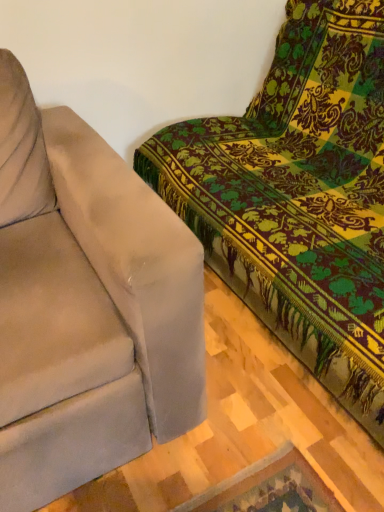
Question: From a real-world perspective, does velvet beige couch at upper right, which is counted as the second studio couch, starting from the left, sit lower than suede-like beige couch at left, which is the first studio couch from left to right?

Choices:
 (A) no
 (B) yes

Answer: (A)

Question: Is velvet beige couch at upper right, which is counted as the second studio couch, starting from the left, located outside suede-like beige couch at left, which is the first studio couch from left to right?

Choices:
 (A) yes
 (B) no

Answer: (A)

Question: Does velvet beige couch at upper right, the first studio couch when ordered from right to left, have a larger size compared to suede-like beige couch at left, marked as the second studio couch in a right-to-left arrangement?

Choices:
 (A) no
 (B) yes

Answer: (B)

Question: Does velvet beige couch at upper right, which is counted as the second studio couch, starting from the left, have a lesser height compared to suede-like beige couch at left, marked as the second studio couch in a right-to-left arrangement?

Choices:
 (A) no
 (B) yes

Answer: (A)

Question: Is velvet beige couch at upper right, which is counted as the second studio couch, starting from the left, positioned behind suede-like beige couch at left, which is the first studio couch from left to right?

Choices:
 (A) no
 (B) yes

Answer: (A)

Question: Is velvet beige couch at upper right, the first studio couch when ordered from right to left, at the right side of suede-like beige couch at left, marked as the second studio couch in a right-to-left arrangement?

Choices:
 (A) no
 (B) yes

Answer: (B)

Question: Is suede-like beige couch at left, which is the first studio couch from left to right, taller than velvet beige couch at upper right, the first studio couch when ordered from right to left?

Choices:
 (A) no
 (B) yes

Answer: (A)

Question: Is suede-like beige couch at left, marked as the second studio couch in a right-to-left arrangement, at the right side of velvet beige couch at upper right, the first studio couch when ordered from right to left?

Choices:
 (A) yes
 (B) no

Answer: (B)

Question: Can you confirm if suede-like beige couch at left, which is the first studio couch from left to right, is wider than velvet beige couch at upper right, the first studio couch when ordered from right to left?

Choices:
 (A) yes
 (B) no

Answer: (B)

Question: From a real-world perspective, is suede-like beige couch at left, which is the first studio couch from left to right, positioned over velvet beige couch at upper right, which is counted as the second studio couch, starting from the left, based on gravity?

Choices:
 (A) yes
 (B) no

Answer: (B)

Question: Is suede-like beige couch at left, marked as the second studio couch in a right-to-left arrangement, facing away from velvet beige couch at upper right, which is counted as the second studio couch, starting from the left?

Choices:
 (A) yes
 (B) no

Answer: (B)

Question: Is suede-like beige couch at left, which is the first studio couch from left to right, smaller than velvet beige couch at upper right, which is counted as the second studio couch, starting from the left?

Choices:
 (A) no
 (B) yes

Answer: (B)

Question: Considering the positions of suede-like beige couch at left, which is the first studio couch from left to right, and velvet beige couch at upper right, which is counted as the second studio couch, starting from the left, in the image, is suede-like beige couch at left, which is the first studio couch from left to right, taller or shorter than velvet beige couch at upper right, which is counted as the second studio couch, starting from the left,?

Choices:
 (A) tall
 (B) short

Answer: (B)